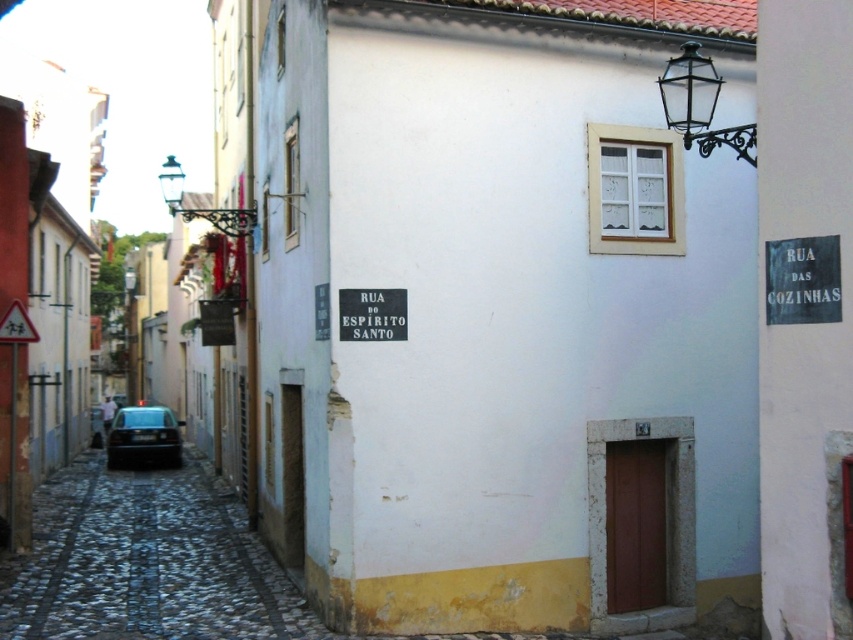
Question: Which object appears closest to the camera in this image?

Choices:
 (A) cobblestone at lower left
 (B) metallic streetlamp at upper left

Answer: (A)

Question: Among these objects, which one is farthest from the camera?

Choices:
 (A) black wrought iron lantern at upper right
 (B) cobblestone at lower left
 (C) metallic streetlamp at upper left

Answer: (C)

Question: Can you confirm if cobblestone at lower left is positioned below yellow plastic triangle at upper left?

Choices:
 (A) no
 (B) yes

Answer: (B)

Question: Does black wrought iron lantern at upper right have a greater width compared to metallic streetlamp at upper left?

Choices:
 (A) yes
 (B) no

Answer: (B)

Question: Can you confirm if cobblestone at lower left is positioned below black wrought iron lantern at upper right?

Choices:
 (A) no
 (B) yes

Answer: (B)

Question: Which object appears closest to the camera in this image?

Choices:
 (A) yellow plastic triangle at upper left
 (B) metallic streetlamp at upper left

Answer: (A)